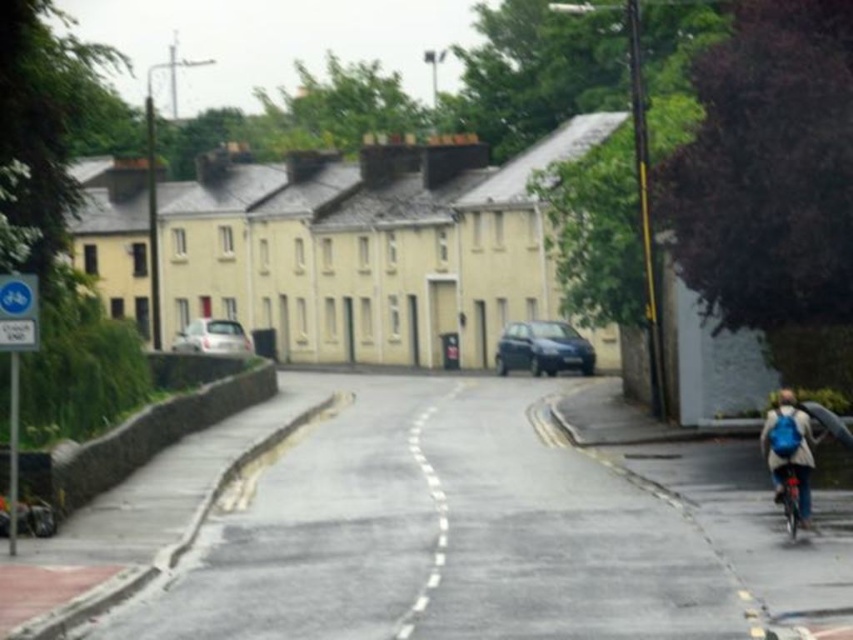
You are standing at the point marked by the coordinates point (213, 337). Which object is directly in front of you?

The white glossy car at center is directly in front of you at the coordinates point (213, 337).

You are a delivery driver in a car that is 1.8 meters wide. You need to pass through a narrow alley that can only accommodate vehicles up to 1.7 meters wide. There is a metallic blue bicycle at lower right parked next to your dark blue metallic car at center. Which vehicle is wider and cannot fit through the alley?

The dark blue metallic car at center is wider than the metallic blue bicycle at lower right. Since the alley can only accommodate vehicles up to 1.7 meters wide and the car is 1.8 meters wide, it cannot fit through the alley. The bicycle is narrower and would fit.